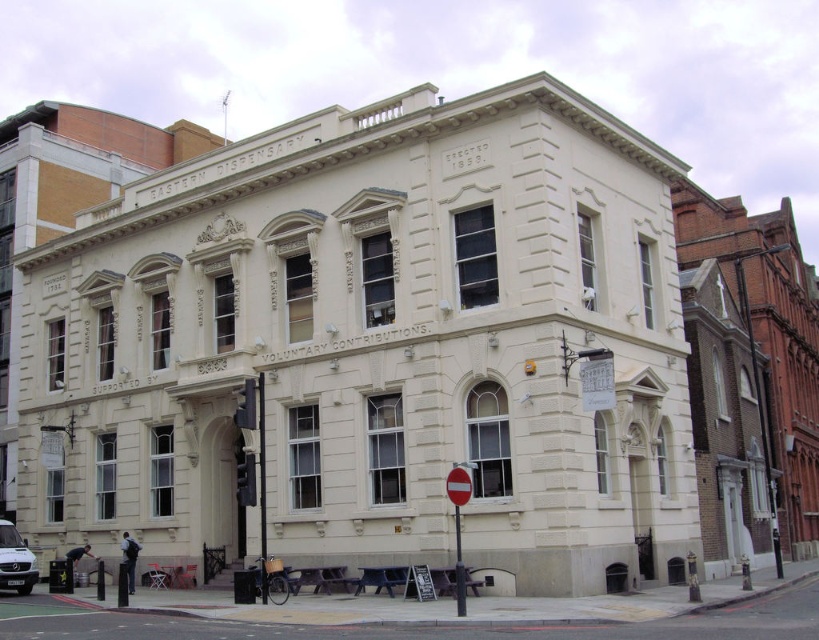
You are standing in front of the two story building and want to take a photo. You notice two points marked on the building facade at coordinates point (7,557) and point (465,593). Which point is closer to your camera?

Point (7,557) is closer to the camera than point (465,593) because it is further to the camera according to the description.

You are a delivery driver approaching the building and need to park your silver metallic van at lower left. The parking space is directly in front of the red plastic sign at center. Will the van fit under the sign without hitting it?

The silver metallic van at lower left has a lesser height compared to the red plastic sign at center, so the van will fit under the sign without any issues.